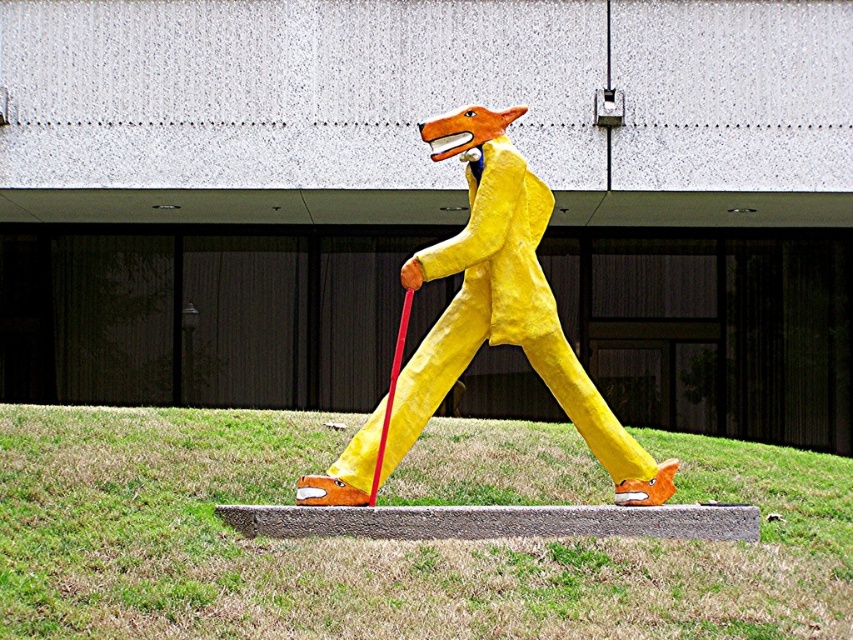
Question: Which of the following is the farthest from the observer?

Choices:
 (A) (155, 452)
 (B) (546, 333)

Answer: (A)

Question: Which point is farther to the camera?

Choices:
 (A) yellow paper mache fox at center
 (B) green grass at center

Answer: (A)

Question: Is green grass at center smaller than yellow paper mache fox at center?

Choices:
 (A) yes
 (B) no

Answer: (A)

Question: Among these points, which one is nearest to the camera?

Choices:
 (A) (561, 396)
 (B) (328, 577)

Answer: (B)

Question: Considering the relative positions of green grass at center and yellow paper mache fox at center in the image provided, where is green grass at center located with respect to yellow paper mache fox at center?

Choices:
 (A) left
 (B) right

Answer: (B)

Question: Does green grass at center have a greater width compared to yellow paper mache fox at center?

Choices:
 (A) no
 (B) yes

Answer: (A)